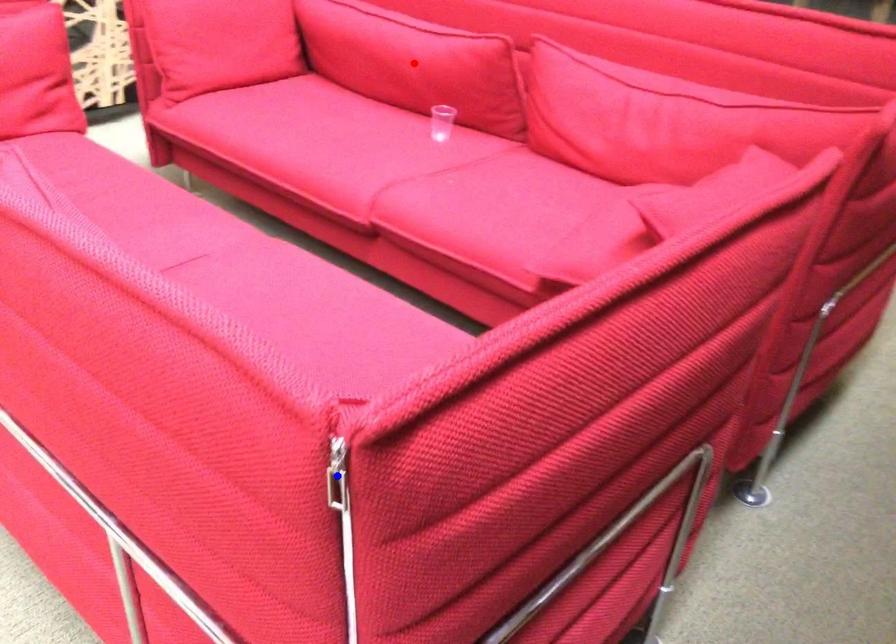
Question: In the image, two points are highlighted. Which point is nearer to the camera? Reply with the corresponding letter.

Choices:
 (A) blue point
 (B) red point

Answer: (A)